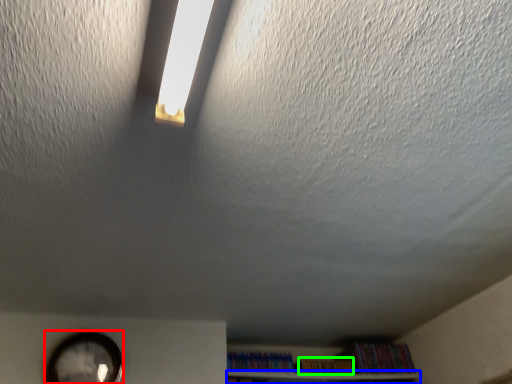
Question: Considering the real-world distances, which object is farthest from clock (highlighted by a red box)? shelf (highlighted by a blue box) or book (highlighted by a green box)?

Choices:
 (A) shelf
 (B) book

Answer: (B)